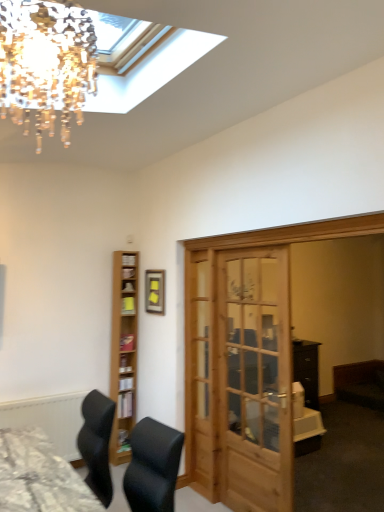
Question: Considering the relative positions of crystal glass chandelier at upper left and light brown wooden shelf at left in the image provided, is crystal glass chandelier at upper left to the left of light brown wooden shelf at left from the viewer's perspective?

Choices:
 (A) yes
 (B) no

Answer: (B)

Question: Can you confirm if crystal glass chandelier at upper left is wider than light brown wooden shelf at left?

Choices:
 (A) no
 (B) yes

Answer: (B)

Question: From a real-world perspective, is crystal glass chandelier at upper left under light brown wooden shelf at left?

Choices:
 (A) no
 (B) yes

Answer: (A)

Question: Is crystal glass chandelier at upper left positioned behind light brown wooden shelf at left?

Choices:
 (A) yes
 (B) no

Answer: (B)

Question: Can you see crystal glass chandelier at upper left touching light brown wooden shelf at left?

Choices:
 (A) no
 (B) yes

Answer: (A)

Question: Is crystal glass chandelier at upper left bigger or smaller than light brown wooden shelf at left?

Choices:
 (A) small
 (B) big

Answer: (A)

Question: In terms of width, does crystal glass chandelier at upper left look wider or thinner when compared to light brown wooden shelf at left?

Choices:
 (A) wide
 (B) thin

Answer: (A)

Question: Is crystal glass chandelier at upper left situated inside light brown wooden shelf at left or outside?

Choices:
 (A) outside
 (B) inside

Answer: (A)

Question: Considering their positions, is crystal glass chandelier at upper left located in front of or behind light brown wooden shelf at left?

Choices:
 (A) behind
 (B) front

Answer: (B)

Question: From a real-world perspective, relative to wooden door at center, is textured gray desk at lower left vertically above or below?

Choices:
 (A) above
 (B) below

Answer: (B)

Question: Looking at the image, does textured gray desk at lower left seem bigger or smaller compared to wooden door at center?

Choices:
 (A) small
 (B) big

Answer: (A)

Question: Is textured gray desk at lower left inside the boundaries of wooden door at center, or outside?

Choices:
 (A) inside
 (B) outside

Answer: (B)

Question: Considering the relative positions of textured gray desk at lower left and wooden door at center in the image provided, is textured gray desk at lower left to the left or to the right of wooden door at center?

Choices:
 (A) left
 (B) right

Answer: (A)

Question: Considering the positions of light brown wooden shelf at left and textured gray desk at lower left in the image, is light brown wooden shelf at left wider or thinner than textured gray desk at lower left?

Choices:
 (A) thin
 (B) wide

Answer: (A)

Question: From the image's perspective, relative to textured gray desk at lower left, is light brown wooden shelf at left above or below?

Choices:
 (A) above
 (B) below

Answer: (A)